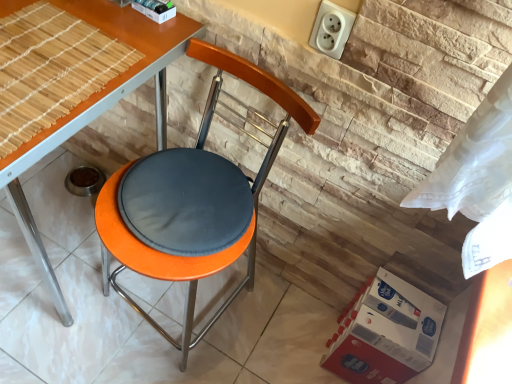
Question: Could you tell me if orange matte stool at center is facing white plastic socket at upper right?

Choices:
 (A) no
 (B) yes

Answer: (A)

Question: Is orange matte stool at center oriented away from white plastic socket at upper right?

Choices:
 (A) yes
 (B) no

Answer: (B)

Question: From the image's perspective, is orange matte stool at center located above white plastic socket at upper right?

Choices:
 (A) no
 (B) yes

Answer: (A)

Question: Considering the relative positions of orange matte stool at center and white plastic socket at upper right in the image provided, is orange matte stool at center to the left of white plastic socket at upper right from the viewer's perspective?

Choices:
 (A) no
 (B) yes

Answer: (B)

Question: Does orange matte stool at center come in front of white plastic socket at upper right?

Choices:
 (A) no
 (B) yes

Answer: (A)

Question: Do you think white plastic socket at upper right is within orange matte table at center, or outside of it?

Choices:
 (A) inside
 (B) outside

Answer: (B)

Question: Is white plastic socket at upper right in front of or behind orange matte table at center in the image?

Choices:
 (A) behind
 (B) front

Answer: (A)

Question: Considering the relative positions of white plastic socket at upper right and orange matte table at center in the image provided, is white plastic socket at upper right to the left or to the right of orange matte table at center?

Choices:
 (A) right
 (B) left

Answer: (A)

Question: In terms of width, does white plastic socket at upper right look wider or thinner when compared to orange matte table at center?

Choices:
 (A) thin
 (B) wide

Answer: (A)

Question: Is bamboo mat at upper left spatially inside white plastic socket at upper right, or outside of it?

Choices:
 (A) outside
 (B) inside

Answer: (A)

Question: From the image's perspective, is bamboo mat at upper left located above or below white plastic socket at upper right?

Choices:
 (A) below
 (B) above

Answer: (A)

Question: Is point (18, 137) positioned closer to the camera than point (312, 39)?

Choices:
 (A) farther
 (B) closer

Answer: (B)

Question: Is bamboo mat at upper left taller or shorter than white plastic socket at upper right?

Choices:
 (A) short
 (B) tall

Answer: (A)

Question: Is bamboo mat at upper left in front of or behind orange matte stool at center in the image?

Choices:
 (A) behind
 (B) front

Answer: (B)

Question: Considering the positions of bamboo mat at upper left and orange matte stool at center in the image, is bamboo mat at upper left taller or shorter than orange matte stool at center?

Choices:
 (A) short
 (B) tall

Answer: (A)